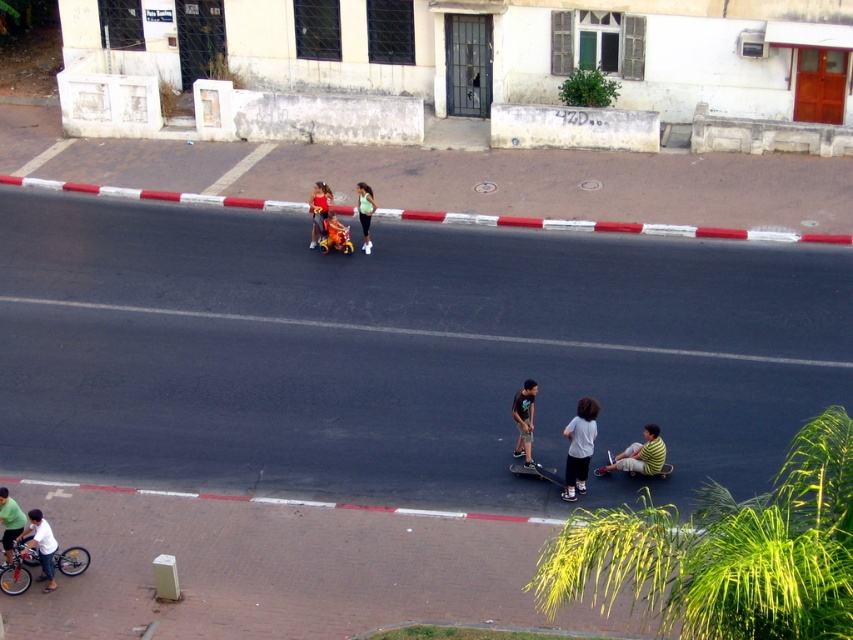
You are a pedestrian trying to cross the street from the sidewalk. There is a brushed metal bicycle at lower left and a black smooth skateboard at center. Which object is closer to your starting position on the sidewalk?

The brushed metal bicycle at lower left is closer to your starting position on the sidewalk because it is in front of the black smooth skateboard at center.